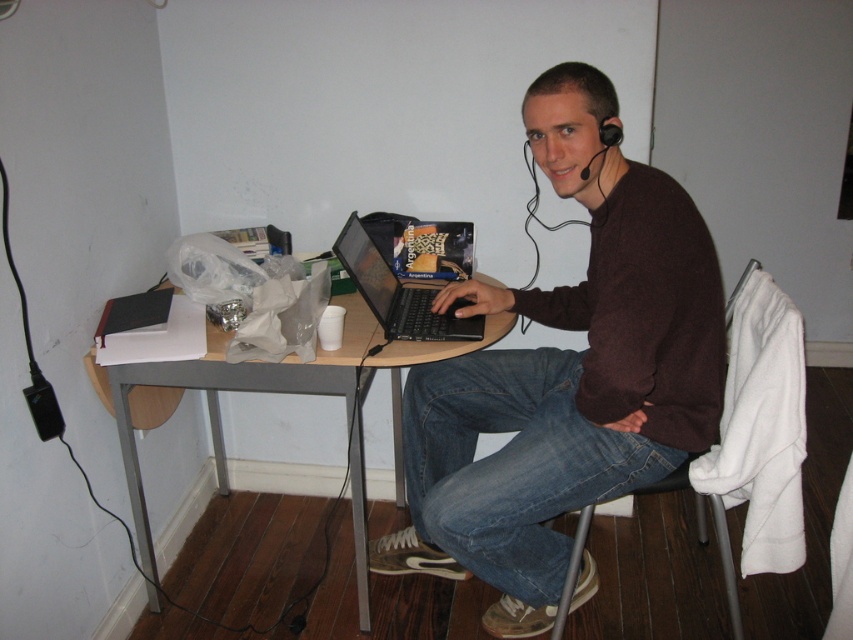
Question: Which of the following is the closest to the observer?

Choices:
 (A) (697, 520)
 (B) (361, 348)
 (C) (387, 266)

Answer: (B)

Question: Observing the image, what is the correct spatial positioning of brown sweater at center in reference to shiny black laptop at center?

Choices:
 (A) above
 (B) below

Answer: (B)

Question: Is brown sweater at center wider than woodenmaterial/texturetable at center?

Choices:
 (A) yes
 (B) no

Answer: (B)

Question: Based on their relative distances, which object is nearer to the black plastic chair at lower center?

Choices:
 (A) woodenmaterial/texturetable at center
 (B) brown sweater at center
 (C) shiny black laptop at center

Answer: (B)

Question: Can you confirm if brown sweater at center is positioned below shiny black laptop at center?

Choices:
 (A) no
 (B) yes

Answer: (B)

Question: Among these points, which one is nearest to the camera?

Choices:
 (A) (717, 524)
 (B) (381, 278)
 (C) (676, 192)
 (D) (202, 381)

Answer: (C)